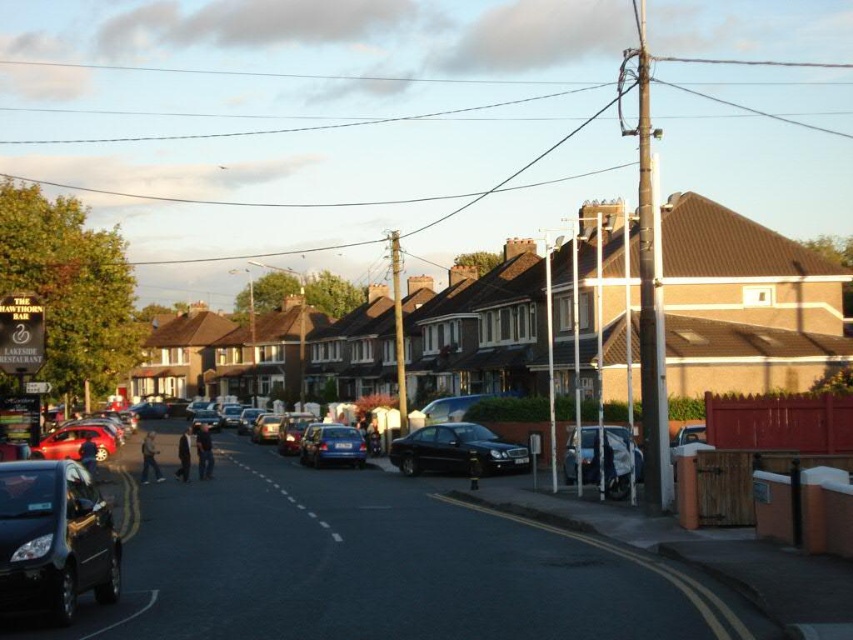
Looking at this image, does shiny black sedan at center appear over metallic silver car at center-right?

No, shiny black sedan at center is not above metallic silver car at center-right.

Is shiny black sedan at center bigger than metallic silver car at center-right?

Correct, shiny black sedan at center is larger in size than metallic silver car at center-right.

Where is `shiny black sedan at center`? The height and width of the screenshot is (640, 853). shiny black sedan at center is located at coordinates (456, 451).

At what (x,y) coordinates should I click in order to perform the action: click on shiny black sedan at center. Please return your answer as a coordinate pair (x, y). This screenshot has width=853, height=640. Looking at the image, I should click on (456, 451).

Identify the location of shiny black sedan at center. Image resolution: width=853 pixels, height=640 pixels. (456, 451).

Measure the distance between point (508,452) and camera.

Point (508,452) is 29.96 meters away from camera.

The height and width of the screenshot is (640, 853). In order to click on shiny black sedan at center in this screenshot , I will do click(456, 451).

Where is `shiny black sedan at center`? This screenshot has width=853, height=640. shiny black sedan at center is located at coordinates (456, 451).

Based on the photo, is brown brick houses at center taller than metallic blue sedan at center?

Yes.

Measure the distance between brown brick houses at center and metallic blue sedan at center.

brown brick houses at center is 31.04 meters away from metallic blue sedan at center.

Does point (705, 280) come behind point (364, 458)?

That is True.

The image size is (853, 640). What are the coordinates of `brown brick houses at center` in the screenshot? It's located at (744, 304).